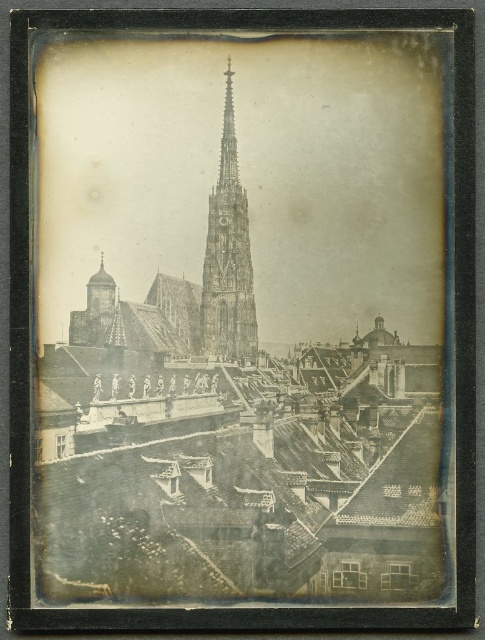
You are an architect analyzing this historical image. You notice the dark gray stone church at center and the stone spire at center. Which of these two structures is positioned to the left in the image?

The stone spire at center is positioned to the left of the dark gray stone church at center.